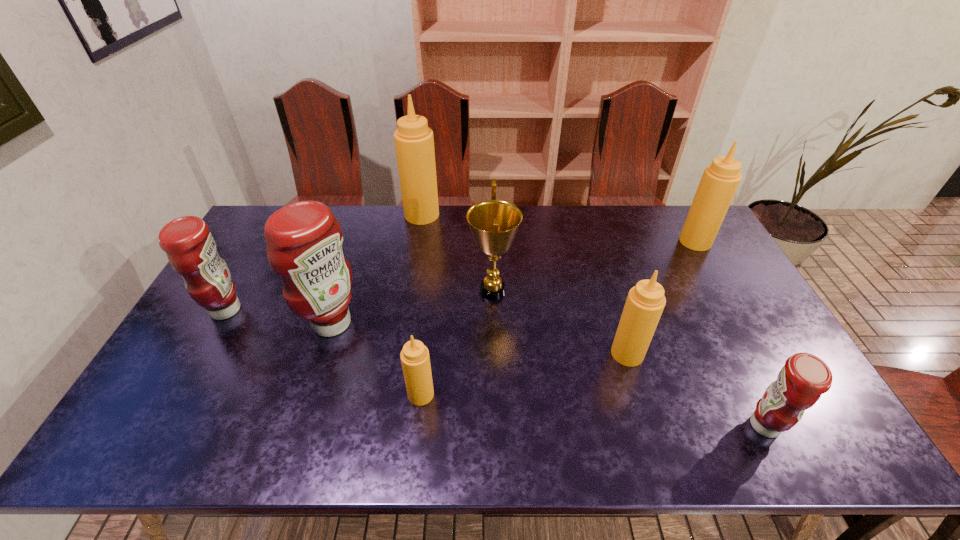
Find the location of a particular element. free space located 0.250m on the front view with handles of the award is located at coordinates (387, 291).

Find the location of `vacant space located 0.090m on the right of the fifth condiment from left to right`. vacant space located 0.090m on the right of the fifth condiment from left to right is located at coordinates (677, 354).

Image resolution: width=960 pixels, height=540 pixels. What are the coordinates of `vacant space located on the back of the leftmost red condiment` in the screenshot? It's located at (244, 278).

Where is `vacant point located 0.210m on the left of the nearest tan condiment`? The height and width of the screenshot is (540, 960). vacant point located 0.210m on the left of the nearest tan condiment is located at coordinates (324, 394).

This screenshot has width=960, height=540. What are the coordinates of `vacant space situated 0.050m on the back of the nearest red condiment` in the screenshot? It's located at (745, 388).

Find the location of a particular element. This screenshot has height=540, width=960. object at the near edge is located at coordinates (803, 379).

Image resolution: width=960 pixels, height=540 pixels. What are the coordinates of `object situated at the left edge` in the screenshot? It's located at (191, 249).

I want to click on object at the far right corner, so click(720, 180).

I want to click on object at the near right corner, so click(x=803, y=379).

In the image, there is a desktop. At what (x,y) coordinates should I click in order to perform the action: click on vacant area at the far edge. Please return your answer as a coordinate pair (x, y). This screenshot has width=960, height=540. Looking at the image, I should click on (380, 215).